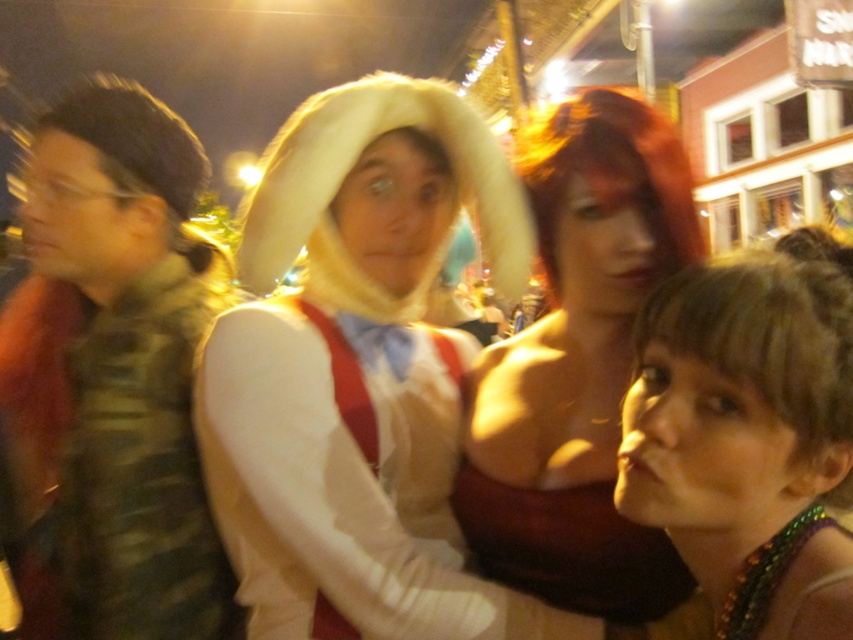
Does shiny red hair at center have a larger size compared to shiny green necklace at lower right?

Yes.

Who is positioned more to the right, shiny red hair at center or shiny green necklace at lower right?

Positioned to the right is shiny green necklace at lower right.

You are a GUI agent. You are given a task and a screenshot of the screen. Output one action in this format:
    pyautogui.click(x=<x>, y=<y>)
    Task: Click on the shiny red hair at center
    The width and height of the screenshot is (853, 640).
    Given the screenshot: What is the action you would take?
    pyautogui.click(x=578, y=365)

Measure the distance from camouflage fabric vest at left to shiny red hair at center.

The distance of camouflage fabric vest at left from shiny red hair at center is 64.80 centimeters.

Who is higher up, camouflage fabric vest at left or shiny red hair at center?

Positioned higher is shiny red hair at center.

The image size is (853, 640). Identify the location of camouflage fabric vest at left. (115, 371).

The image size is (853, 640). In order to click on camouflage fabric vest at left in this screenshot , I will do coord(115,371).

Find the location of `camouflage fabric vest at left`. camouflage fabric vest at left is located at coordinates (115, 371).

Does camouflage fabric vest at left appear over shiny green necklace at lower right?

Correct, camouflage fabric vest at left is located above shiny green necklace at lower right.

I want to click on camouflage fabric vest at left, so click(115, 371).

Identify the location of camouflage fabric vest at left. This screenshot has height=640, width=853. (115, 371).